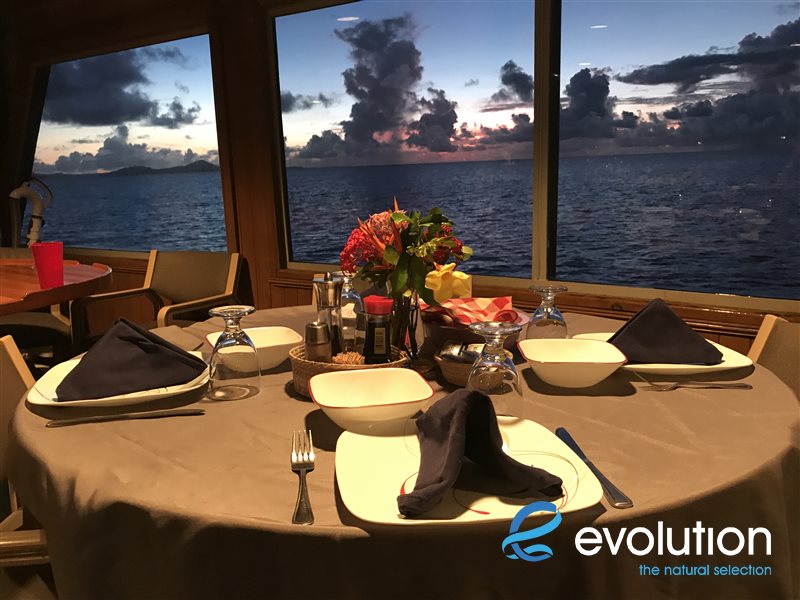
What are the coordinates of `fork` in the screenshot? It's located at (301, 466), (681, 379), (198, 343).